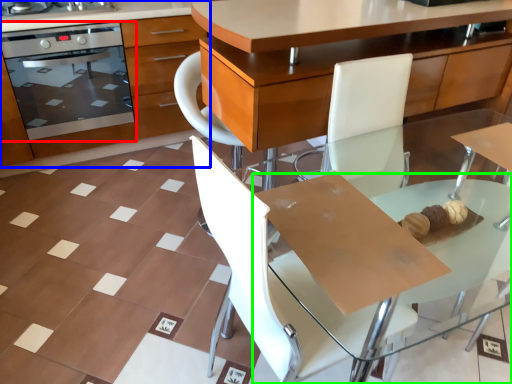
Question: Which object is the closest to the kitchen appliance (highlighted by a red box)? Choose among these: cabinetry (highlighted by a blue box) or round table (highlighted by a green box).

Choices:
 (A) cabinetry
 (B) round table

Answer: (A)